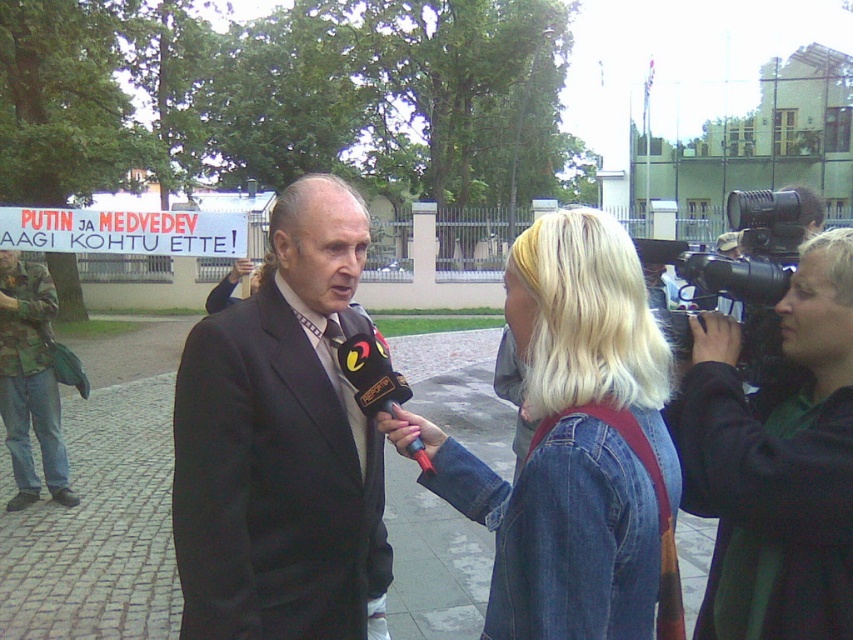
Question: Does black suit at center have a greater width compared to camouflage fabric jacket at left?

Choices:
 (A) no
 (B) yes

Answer: (A)

Question: Which point is farther to the camera?

Choices:
 (A) blonde hair at upper right
 (B) denim jacket at center
 (C) black suit at center

Answer: (C)

Question: Is blonde hair at upper right closer to the viewer compared to camouflage fabric jacket at left?

Choices:
 (A) no
 (B) yes

Answer: (B)

Question: Does black suit at center appear on the right side of camouflage fabric jacket at left?

Choices:
 (A) yes
 (B) no

Answer: (A)

Question: Which object appears farthest from the camera in this image?

Choices:
 (A) blonde hair at upper right
 (B) camouflage fabric jacket at left
 (C) black suit at center
 (D) denim jacket at center

Answer: (B)

Question: Which point is farther to the camera?

Choices:
 (A) [244, 413]
 (B) [706, 433]
 (C) [33, 342]

Answer: (C)